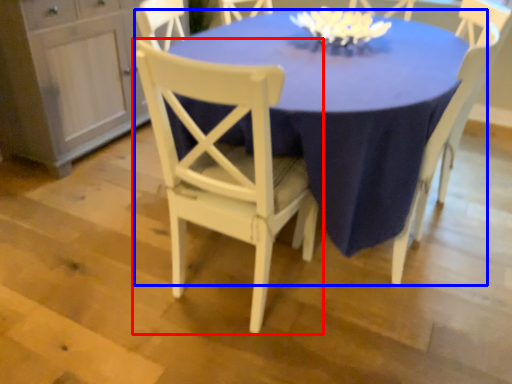
Question: Which object appears closest to the camera in this image, chair (highlighted by a red box) or table (highlighted by a blue box)?

Choices:
 (A) chair
 (B) table

Answer: (A)